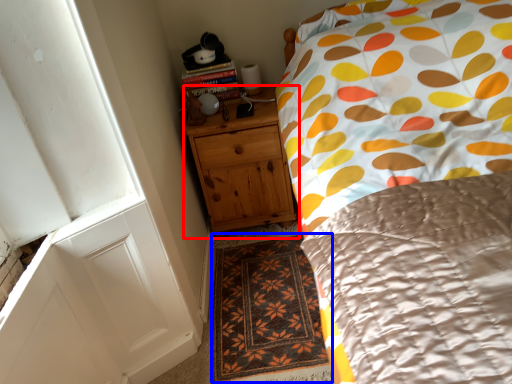
Question: Which point is closer to the camera, chest of drawers (highlighted by a red box) or doormat (highlighted by a blue box)?

Choices:
 (A) chest of drawers
 (B) doormat

Answer: (B)